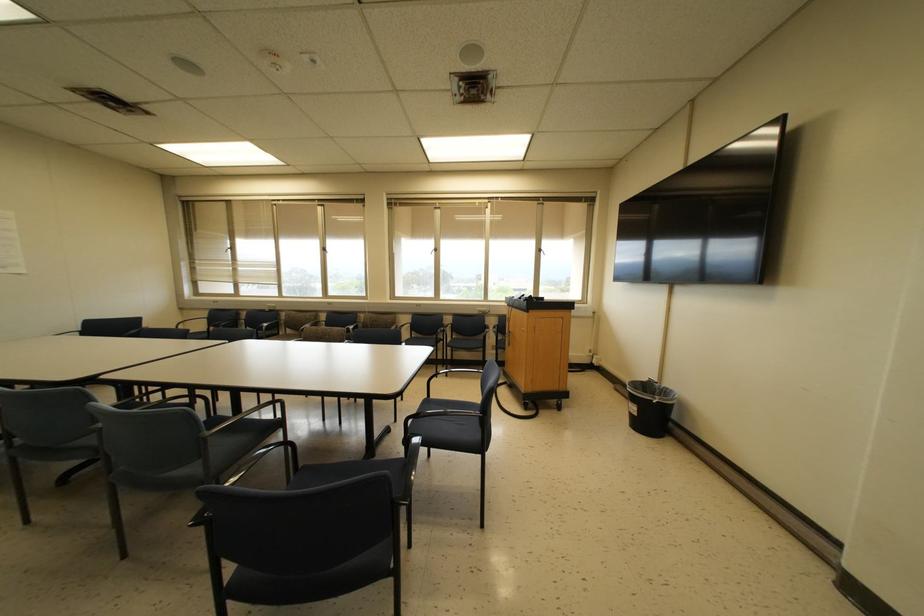
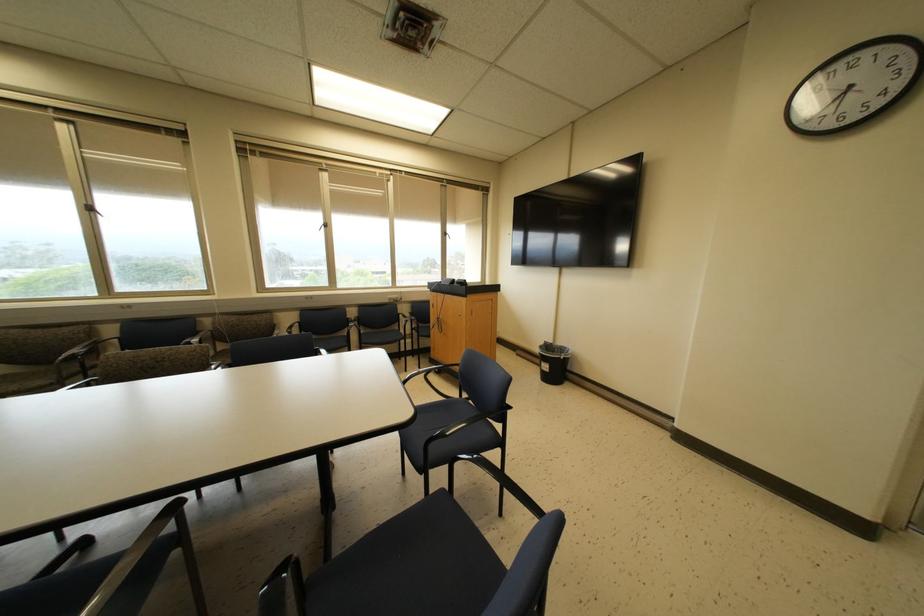
Question: How did the camera likely rotate?

Choices:
 (A) Left
 (B) Right
 (C) Up
 (D) Down

Answer: (B)